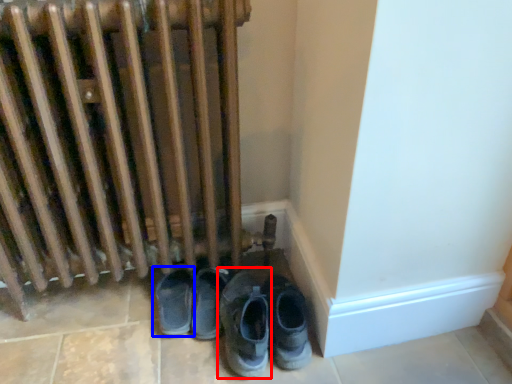
Question: Among these objects, which one is farthest to the camera, footwear (highlighted by a red box) or footwear (highlighted by a blue box)?

Choices:
 (A) footwear
 (B) footwear

Answer: (B)